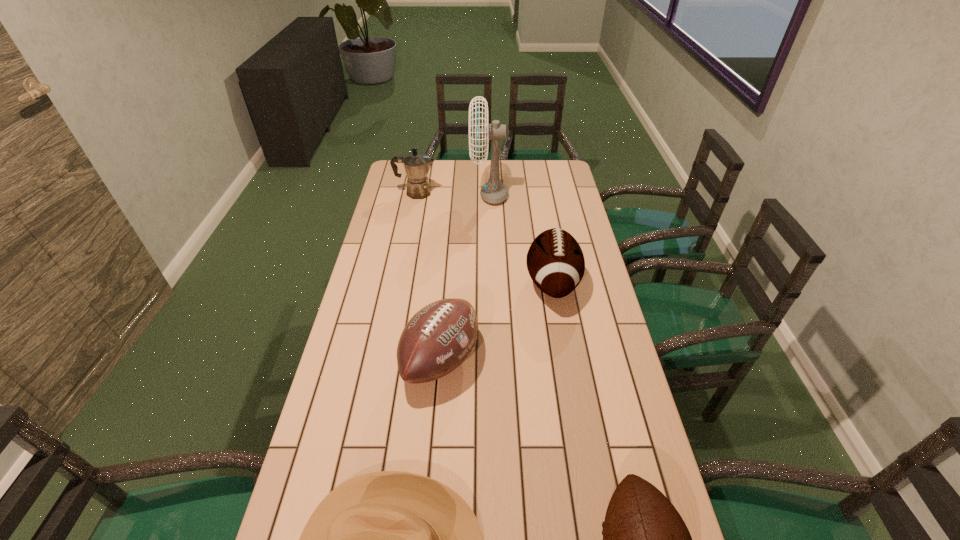
Locate an element on the screen. This screenshot has width=960, height=540. fan is located at coordinates (494, 192).

Where is `coffeepot`? The height and width of the screenshot is (540, 960). coffeepot is located at coordinates (416, 165).

The width and height of the screenshot is (960, 540). I want to click on the second nearest football, so click(438, 338).

The height and width of the screenshot is (540, 960). Identify the location of the leftmost football. (438, 338).

The image size is (960, 540). What are the coordinates of `the farthest football` in the screenshot? It's located at (555, 261).

The height and width of the screenshot is (540, 960). What are the coordinates of `vacant region located 0.300m on the front-facing side of the tallest object` in the screenshot? It's located at pyautogui.click(x=403, y=195).

This screenshot has width=960, height=540. Identify the location of free spot located on the front-facing side of the tallest object. (395, 195).

Identify the location of free space located 0.340m on the front-facing side of the tallest object. This screenshot has height=540, width=960. (395, 195).

You are a GUI agent. You are given a task and a screenshot of the screen. Output one action in this format:
    pyautogui.click(x=<x>, y=<y>)
    Task: Click on the blank space located on the pouring side of the coffeepot
    
    Given the screenshot: What is the action you would take?
    pyautogui.click(x=513, y=193)

In order to click on free space located 0.260m on the front of the leftmost football in this screenshot , I will do `click(430, 501)`.